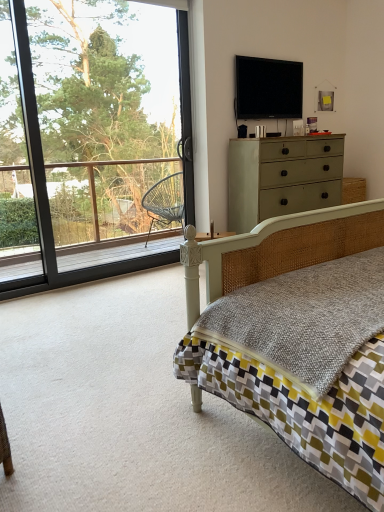
Question: Is point (261, 172) positioned closer to the camera than point (264, 110)?

Choices:
 (A) farther
 (B) closer

Answer: (B)

Question: From the image's perspective, is matte green dresser at upper right located above or below flat screen tv at upper center?

Choices:
 (A) below
 (B) above

Answer: (A)

Question: Which object is the farthest from the matte green dresser at upper right?

Choices:
 (A) matte wicker bed at center
 (B) flat screen tv at upper center
 (C) transparent glass window at upper left

Answer: (C)

Question: Estimate the real-world distances between objects in this image. Which object is farther from the matte green dresser at upper right?

Choices:
 (A) transparent glass window at upper left
 (B) matte wicker bed at center
 (C) flat screen tv at upper center

Answer: (A)